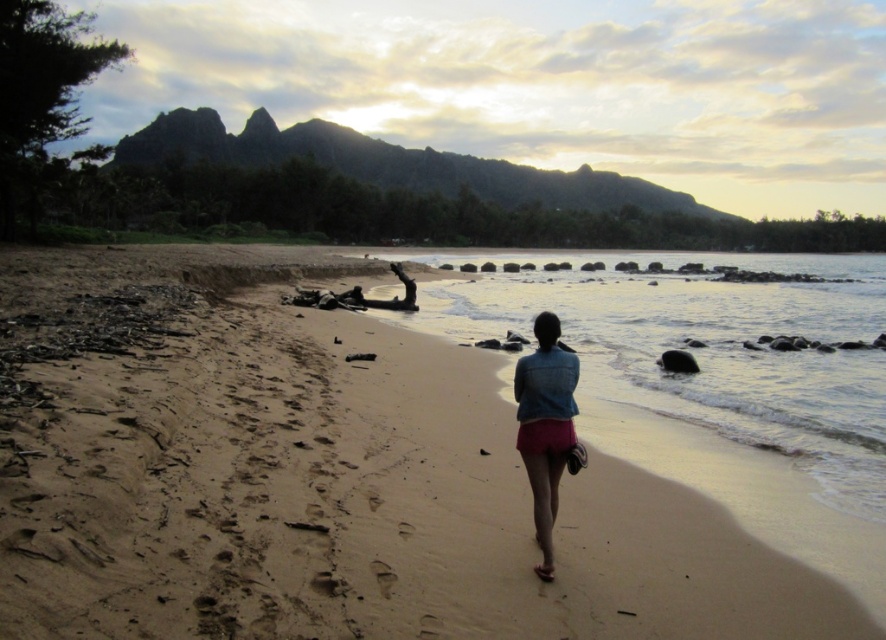
Image resolution: width=886 pixels, height=640 pixels. Describe the element at coordinates (321, 477) in the screenshot. I see `sandy beach at center` at that location.

Between point (10, 273) and point (552, 524), which one is positioned behind?

The point (10, 273) is more distant.

Image resolution: width=886 pixels, height=640 pixels. Identify the location of sandy beach at center. (321, 477).

Who is higher up, clear water at center or pink denim shorts at center?

clear water at center is above.

Find the location of a particular element. The image size is (886, 640). clear water at center is located at coordinates (706, 348).

You are a GUI agent. You are given a task and a screenshot of the screen. Output one action in this format:
    pyautogui.click(x=<x>, y=<y>)
    Task: Click on the clear water at center
    The height and width of the screenshot is (640, 886).
    Given the screenshot: What is the action you would take?
    [x=706, y=348]

Measure the distance from sandy beach at center to clear water at center.

14.56 meters

The width and height of the screenshot is (886, 640). What do you see at coordinates (321, 477) in the screenshot?
I see `sandy beach at center` at bounding box center [321, 477].

Locate an element on the screen. sandy beach at center is located at coordinates (321, 477).